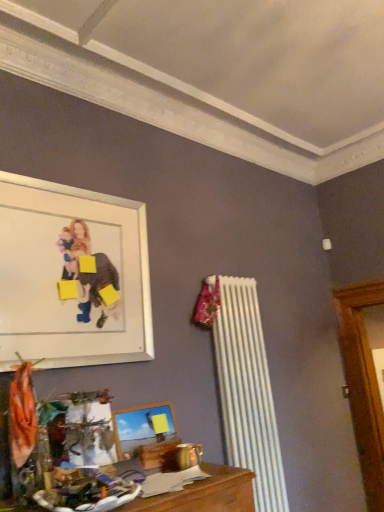
In order to click on free space above white matte picture frame at upper left, the second picture frame when ordered from bottom to top (from a real-world perspective) in this screenshot , I will do `click(82, 190)`.